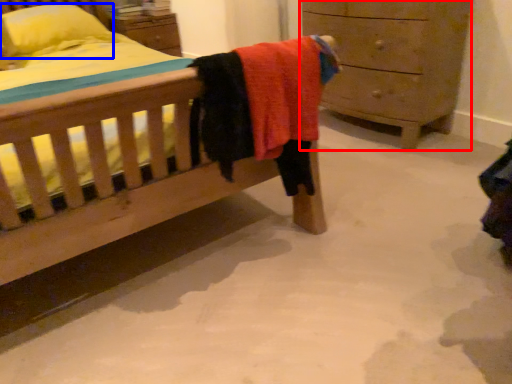
Question: Which point is further to the camera, chest of drawers (highlighted by a red box) or pillow (highlighted by a blue box)?

Choices:
 (A) chest of drawers
 (B) pillow

Answer: (B)